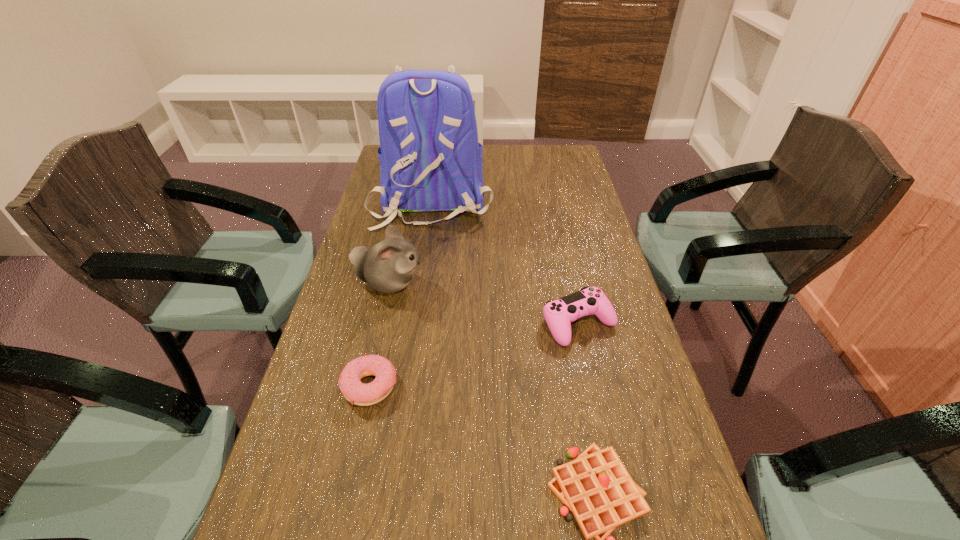
I want to click on vacant area that lies between the fourth farthest object and the third shortest object, so click(x=474, y=355).

Locate an element on the screen. vacant area between the backpack and the control is located at coordinates (505, 262).

Locate an element on the screen. This screenshot has width=960, height=540. vacant area between the second shortest object and the control is located at coordinates (474, 355).

The image size is (960, 540). What are the coordinates of `object that ranks as the second closest to the second tallest object` in the screenshot? It's located at (356, 392).

Locate an element on the screen. object that is the closest to the second nearest object is located at coordinates (388, 267).

The width and height of the screenshot is (960, 540). Identify the location of vacant space that satisfies the following two spatial constraints: 1. on the back of the tallest object; 2. on the right side of the control. (414, 323).

This screenshot has width=960, height=540. Find the location of `free space that satisfies the following two spatial constraints: 1. on the back side of the third shortest object; 2. on the face of the hamster`. free space that satisfies the following two spatial constraints: 1. on the back side of the third shortest object; 2. on the face of the hamster is located at coordinates (569, 284).

The width and height of the screenshot is (960, 540). Identify the location of blank area in the image that satisfies the following two spatial constraints: 1. on the face of the fourth tallest object; 2. on the right side of the second tallest object. (367, 386).

Image resolution: width=960 pixels, height=540 pixels. I want to click on vacant area that satisfies the following two spatial constraints: 1. on the face of the fourth shortest object; 2. on the right side of the control, so click(380, 323).

The height and width of the screenshot is (540, 960). Find the location of `vacant space that satisfies the following two spatial constraints: 1. on the face of the second shortest object; 2. on the left side of the fourth shortest object`. vacant space that satisfies the following two spatial constraints: 1. on the face of the second shortest object; 2. on the left side of the fourth shortest object is located at coordinates (367, 386).